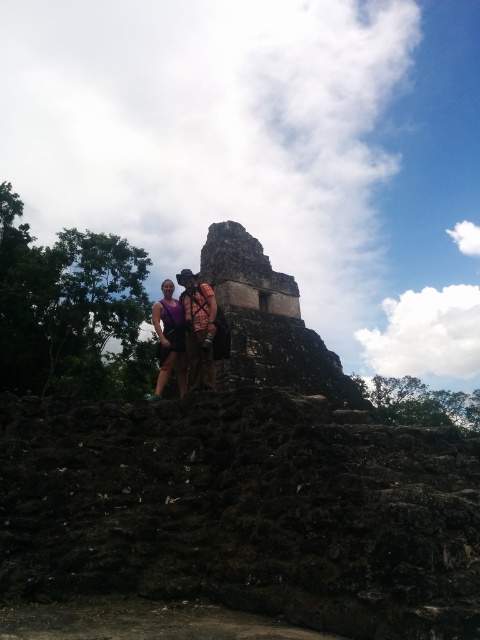
In the scene shown: Is rustic stone structure at center to the right of matte purple tank top at center from the viewer's perspective?

Yes, rustic stone structure at center is to the right of matte purple tank top at center.

Which of these two, rustic stone structure at center or matte purple tank top at center, stands taller?

With more height is matte purple tank top at center.

Image resolution: width=480 pixels, height=640 pixels. What do you see at coordinates (244, 272) in the screenshot?
I see `rustic stone structure at center` at bounding box center [244, 272].

This screenshot has width=480, height=640. Identify the location of rustic stone structure at center. (244, 272).

Does point (159, 330) lie behind point (165, 291)?

No, it is in front of (165, 291).

At what (x,y) coordinates should I click in order to perform the action: click on matte purple shirt at center. Please return your answer as a coordinate pair (x, y). This screenshot has width=480, height=640. Looking at the image, I should click on (184, 333).

Can you confirm if rustic stone structure at center is smaller than matte purple shirt at center?

Indeed, rustic stone structure at center has a smaller size compared to matte purple shirt at center.

Identify the location of rustic stone structure at center. The width and height of the screenshot is (480, 640). (244, 272).

Find the location of a particular element. The height and width of the screenshot is (640, 480). rustic stone structure at center is located at coordinates (244, 272).